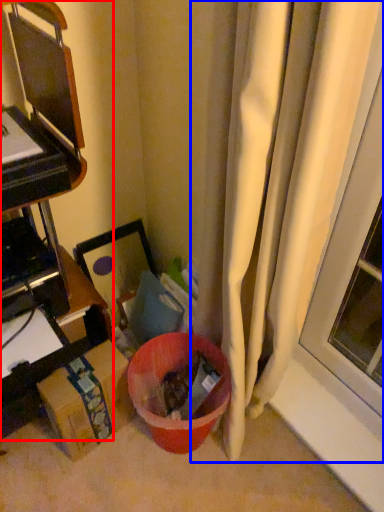
Question: Which of the following is the closest to the observer, furniture (highlighted by a red box) or curtain (highlighted by a blue box)?

Choices:
 (A) furniture
 (B) curtain

Answer: (B)